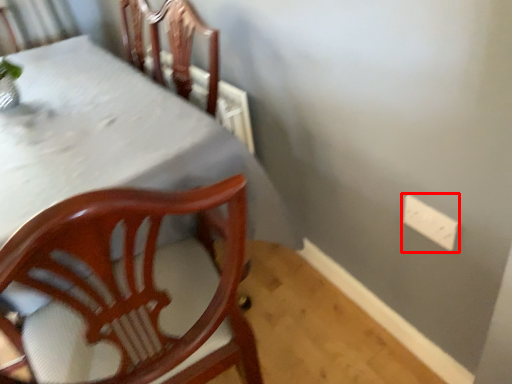
Question: From the image, what is the correct spatial relationship of electric outlet (annotated by the red box) in relation to table?

Choices:
 (A) left
 (B) right

Answer: (B)